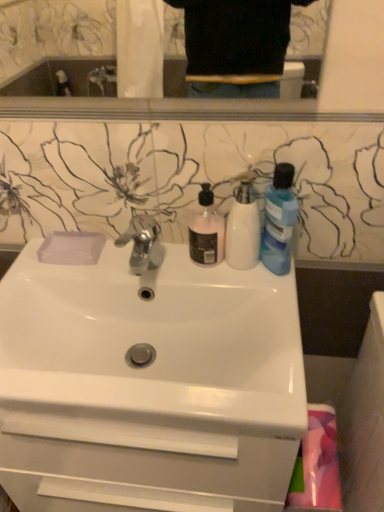
The image size is (384, 512). I want to click on free space in front of transparent plastic soap at upper left, so click(x=61, y=274).